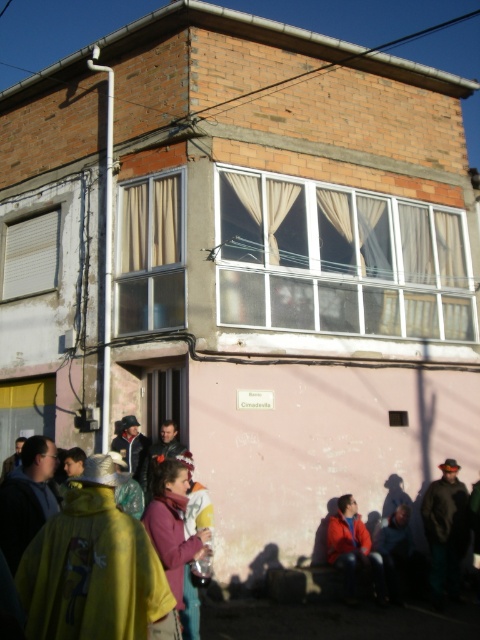
Looking at this image, is beige fabric curtain at upper left in front of white matte window at upper left?

Yes, it is in front of white matte window at upper left.

Is point (176, 241) more distant than point (35, 236)?

No, it is in front of (35, 236).

Is point (143, 310) closer to camera compared to point (13, 288)?

That is True.

This screenshot has height=640, width=480. I want to click on beige fabric curtain at upper left, so click(x=151, y=256).

Is point (409, 288) farther from viewer compared to point (13, 225)?

No.

In the scene shown: Between white glass window at center and white matte window at upper left, which one has less height?

white matte window at upper left is shorter.

Who is more distant from viewer, (299, 326) or (6, 262)?

The point (6, 262) is more distant.

Locate an element on the screen. This screenshot has width=480, height=640. white glass window at center is located at coordinates (339, 259).

Between beige fabric curtain at upper left and dark gray fabric jacket at lower right, which one appears on the left side from the viewer's perspective?

beige fabric curtain at upper left

Which is below, beige fabric curtain at upper left or dark gray fabric jacket at lower right?

dark gray fabric jacket at lower right is below.

What do you see at coordinates (151, 256) in the screenshot?
I see `beige fabric curtain at upper left` at bounding box center [151, 256].

You are a GUI agent. You are given a task and a screenshot of the screen. Output one action in this format:
    pyautogui.click(x=<x>, y=<y>)
    Task: Click on the beige fabric curtain at upper left
    The height and width of the screenshot is (640, 480).
    Given the screenshot: What is the action you would take?
    pyautogui.click(x=151, y=256)